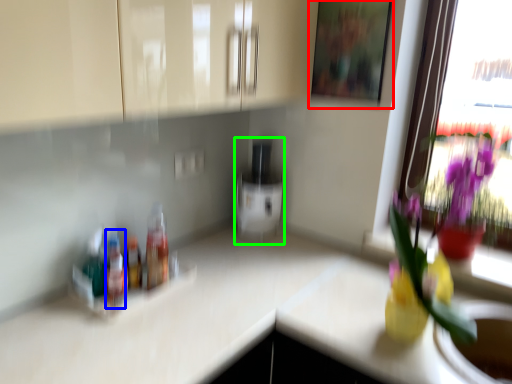
Question: Considering the real-world distances, which object is closest to picture frame (highlighted by a red box)? bottle (highlighted by a blue box) or appliance (highlighted by a green box).

Choices:
 (A) bottle
 (B) appliance

Answer: (B)